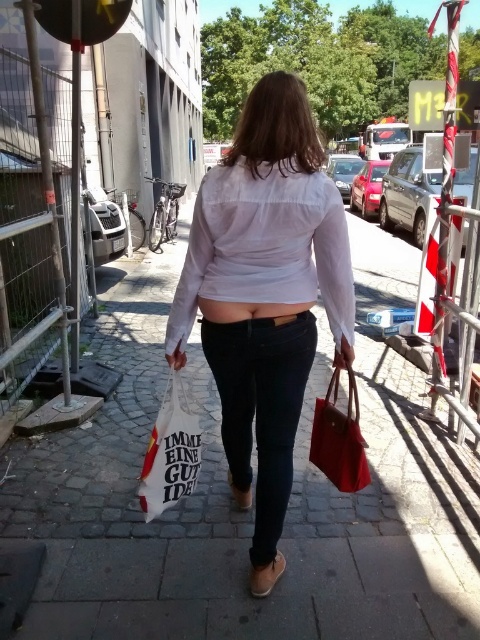
Question: Which object is closer to the camera taking this photo?

Choices:
 (A) matte red handbag at center
 (B) cobblestone pavement at center
 (C) black denim jeans at center

Answer: (B)

Question: Is white paper bag at center wider than matte red handbag at center?

Choices:
 (A) yes
 (B) no

Answer: (A)

Question: Can you confirm if matte white blouse at center is bigger than brown leather sandal at lower center?

Choices:
 (A) no
 (B) yes

Answer: (B)

Question: Considering the relative positions of matte white blouse at center and matte red handbag at center in the image provided, where is matte white blouse at center located with respect to matte red handbag at center?

Choices:
 (A) below
 (B) above

Answer: (B)

Question: Which of the following is the closest to the observer?

Choices:
 (A) brown suede sandal at lower center
 (B) white paper bag at center
 (C) black denim jeans at center

Answer: (C)

Question: Which object is closer to the camera taking this photo?

Choices:
 (A) white paper bag at center
 (B) cobblestone pavement at center
 (C) black denim jeans at center
 (D) matte white blouse at center

Answer: (D)